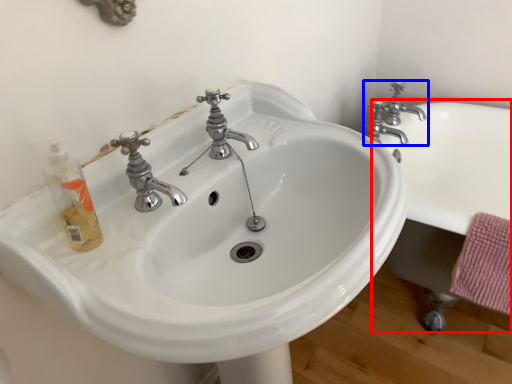
Question: Which point is further to the camera, bath (highlighted by a red box) or tap (highlighted by a blue box)?

Choices:
 (A) bath
 (B) tap

Answer: (B)